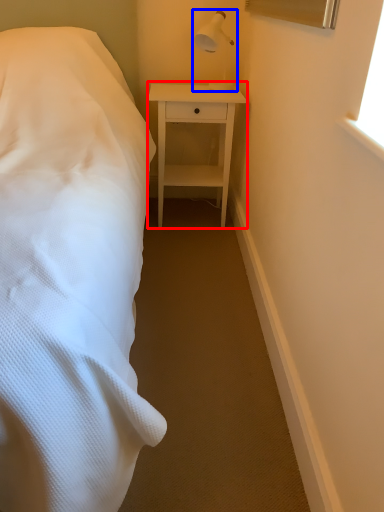
Question: Which point is further to the camera, nightstand (highlighted by a red box) or bedside lamp (highlighted by a blue box)?

Choices:
 (A) nightstand
 (B) bedside lamp

Answer: (A)